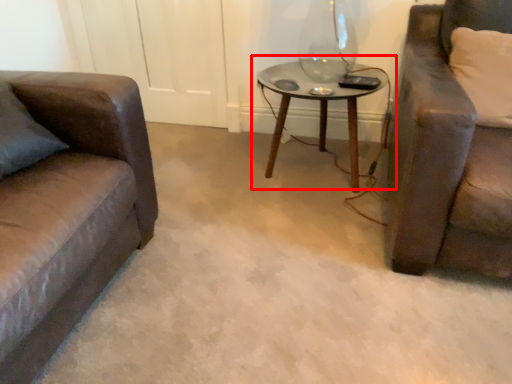
Question: Where is table (annotated by the red box) located in relation to pillow in the image?

Choices:
 (A) left
 (B) right

Answer: (A)